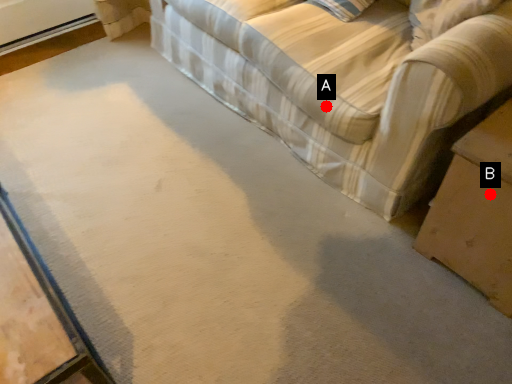
Question: Two points are circled on the image, labeled by A and B beside each circle. Which point is farther to the camera?

Choices:
 (A) A is further
 (B) B is further

Answer: (A)